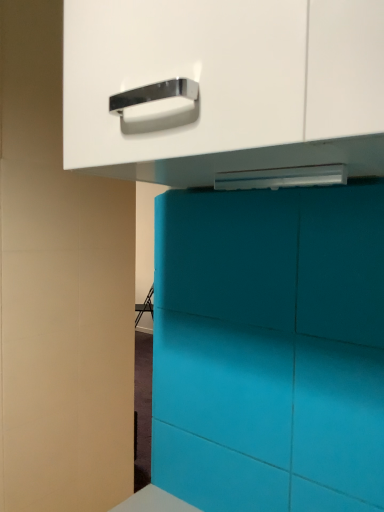
What do you see at coordinates (224, 90) in the screenshot?
I see `white glossy cabinet handle at upper center` at bounding box center [224, 90].

You are a GUI agent. You are given a task and a screenshot of the screen. Output one action in this format:
    pyautogui.click(x=<x>, y=<y>)
    Task: Click on the white glossy cabinet handle at upper center
    This screenshot has height=512, width=384.
    Given the screenshot: What is the action you would take?
    pyautogui.click(x=224, y=90)

Measure the distance between point (111, 67) and camera.

The depth of point (111, 67) is 22.56 inches.

Locate an element on the screen. white glossy cabinet handle at upper center is located at coordinates (224, 90).